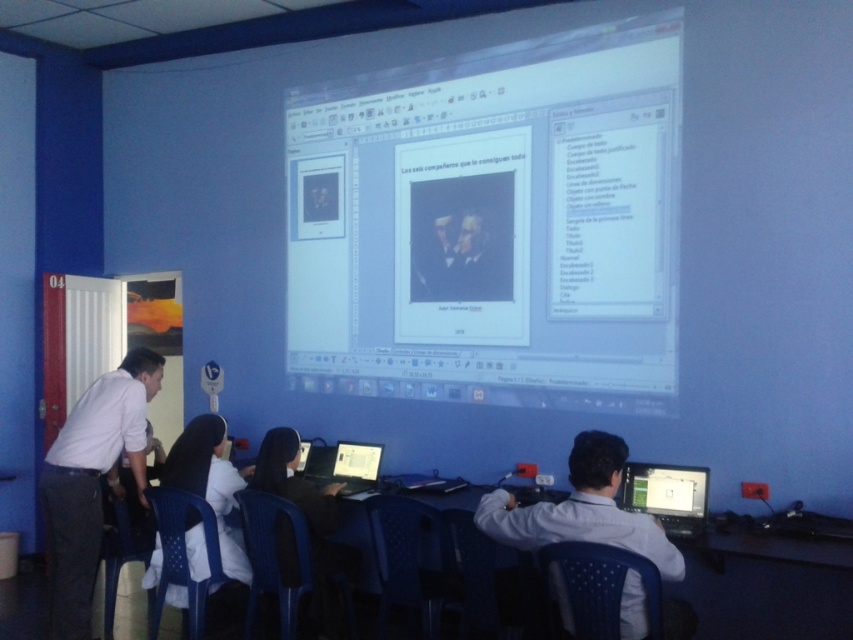
You are a photographer in the classroom who needs to capture a closeup of the white shirt at lower right and the white fabric at lower left. Which object should you focus your camera on first to ensure it is in sharp focus?

The white shirt at lower right is closer to the viewer than the white fabric at lower left, so you should focus your camera on the white shirt at lower right first to ensure it is in sharp focus.

You are standing at the point labeled point [178,440] in the classroom. You need to reach a whiteboard located 3.91 meters away from your current position. Can you walk straight to it without any obstacles?

Yes, you can walk straight to the whiteboard located 3.91 meters away from point [178,440] since there are no obstacles mentioned in the scene description.

You are organizing a classroom event and need to arrange additional seating. Considering the white shirt at left and the white plastic chair at center, which object takes up more physical space in the classroom?

The white plastic chair at center occupies more physical space than the white shirt at left, so it takes up more room in the classroom.